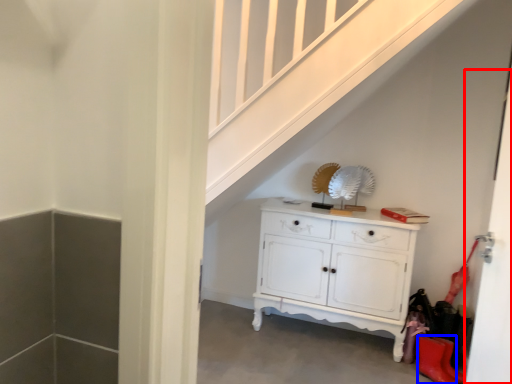
Question: Which object is further to the camera taking this photo, door (highlighted by a red box) or shoe (highlighted by a blue box)?

Choices:
 (A) door
 (B) shoe

Answer: (B)